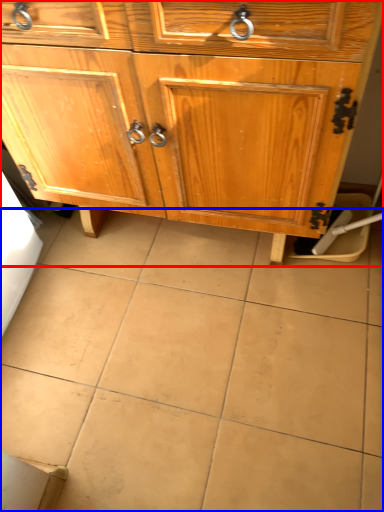
Question: Which object is closer to the camera taking this photo, chest of drawers (highlighted by a red box) or ceramic tile (highlighted by a blue box)?

Choices:
 (A) chest of drawers
 (B) ceramic tile

Answer: (A)